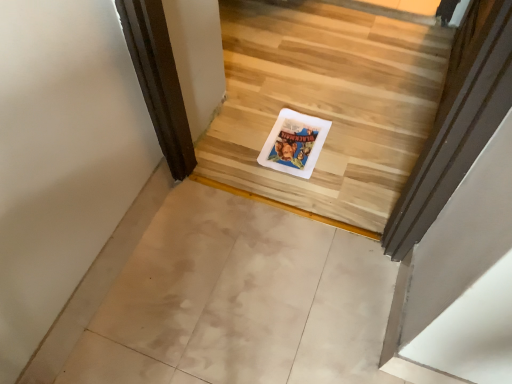
Where is `empty space that is ontop of white matte comic book at center (from a real-world perspective)`? The height and width of the screenshot is (384, 512). empty space that is ontop of white matte comic book at center (from a real-world perspective) is located at coordinates (293, 139).